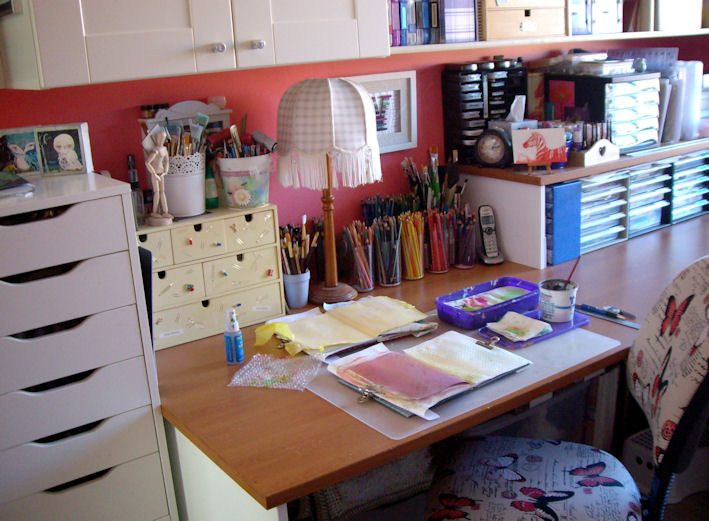
Locate an element on the screen. This screenshot has height=521, width=709. doll is located at coordinates (156, 160).